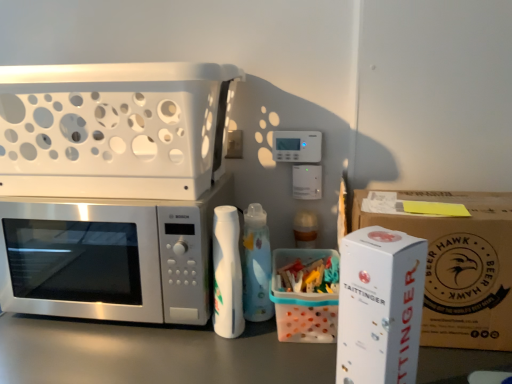
Question: Can you confirm if white plastic basket at upper left, the second appliance when ordered from bottom to top, is smaller than white cardboard box at right, acting as the second appliance starting from the top?

Choices:
 (A) yes
 (B) no

Answer: (B)

Question: Could you tell me if white plastic basket at upper left, the second appliance when ordered from right to left, is facing white cardboard box at right, acting as the second appliance starting from the top?

Choices:
 (A) yes
 (B) no

Answer: (B)

Question: Are white plastic basket at upper left, the second appliance when ordered from bottom to top, and white cardboard box at right, acting as the first appliance starting from the front, beside each other?

Choices:
 (A) yes
 (B) no

Answer: (B)

Question: Would you say white plastic basket at upper left, which is the first appliance in back-to-front order, is outside white cardboard box at right, acting as the first appliance starting from the front?

Choices:
 (A) yes
 (B) no

Answer: (A)

Question: Is white plastic basket at upper left, marked as the first appliance in a left-to-right arrangement, positioned with its back to white cardboard box at right, the 1th appliance ordered from the bottom?

Choices:
 (A) no
 (B) yes

Answer: (A)

Question: Is white plastic basket at upper left, the second appliance when ordered from bottom to top, to the left of white cardboard box at right, acting as the second appliance starting from the top, from the viewer's perspective?

Choices:
 (A) yes
 (B) no

Answer: (A)

Question: From a real-world perspective, is white cardboard box at right, which is counted as the second appliance, starting from the left, below white plastic basket at upper left, the first appliance when ordered from top to bottom?

Choices:
 (A) yes
 (B) no

Answer: (A)

Question: Does white cardboard box at right, which appears as the 1th appliance when viewed from the right, come in front of white plastic basket at upper left, which is the first appliance in back-to-front order?

Choices:
 (A) yes
 (B) no

Answer: (A)

Question: Considering the relative sizes of white cardboard box at right, acting as the first appliance starting from the front, and white plastic basket at upper left, marked as the first appliance in a left-to-right arrangement, in the image provided, is white cardboard box at right, acting as the first appliance starting from the front, bigger than white plastic basket at upper left, marked as the first appliance in a left-to-right arrangement,?

Choices:
 (A) no
 (B) yes

Answer: (A)

Question: Is white cardboard box at right, the 2th appliance positioned from the back, smaller than white plastic basket at upper left, which is the first appliance in back-to-front order?

Choices:
 (A) no
 (B) yes

Answer: (B)

Question: From the image's perspective, is white cardboard box at right, the 1th appliance ordered from the bottom, on top of white plastic basket at upper left, marked as the first appliance in a left-to-right arrangement?

Choices:
 (A) yes
 (B) no

Answer: (B)

Question: Is white cardboard box at right, acting as the second appliance starting from the top, positioned behind white plastic basket at upper left, the second appliance when ordered from right to left?

Choices:
 (A) yes
 (B) no

Answer: (B)

Question: Does satin silver microwave at left lie behind translucent plastic container at center, the first cardboard box positioned from the left?

Choices:
 (A) no
 (B) yes

Answer: (B)